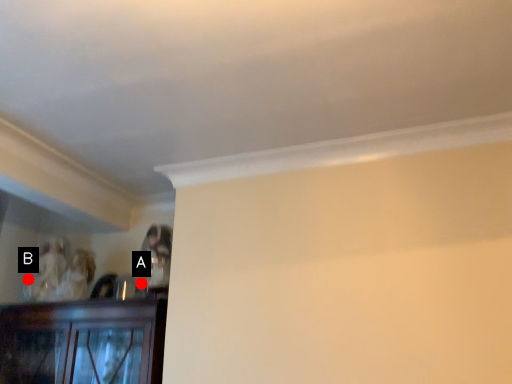
Question: Two points are circled on the image, labeled by A and B beside each circle. Which of the following is the closest to the observer?

Choices:
 (A) A is closer
 (B) B is closer

Answer: (A)